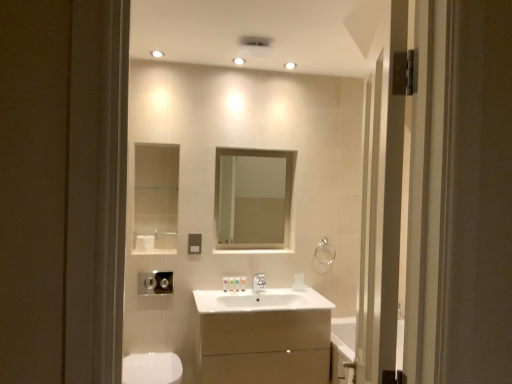
Question: From the image's perspective, relative to translucent plastic soap at center, the second toiletry in the right-to-left sequence, is clear glass mirror at center above or below?

Choices:
 (A) above
 (B) below

Answer: (A)

Question: Is point (229, 221) positioned closer to the camera than point (237, 284)?

Choices:
 (A) closer
 (B) farther

Answer: (B)

Question: Which of these objects is positioned farthest from the silver metallic faucet at center?

Choices:
 (A) translucent plastic soap at center, the second toiletry in the right-to-left sequence
 (B) white glossy light fixture at upper center
 (C) white glossy toilet bowl at lower left
 (D) silver metallic towel bar at center right
 (E) white glossy cabinet at center

Answer: (B)

Question: Based on their relative distances, which object is nearer to the silver metallic faucet at center?

Choices:
 (A) translucent plastic soap at center, arranged as the 1th toiletry when viewed from the left
 (B) white glossy tube at center, the first toiletry from the right
 (C) metallic silver hand dryer at lower center
 (D) matte silver switch at center
 (E) silver metallic towel bar at center right

Answer: (B)